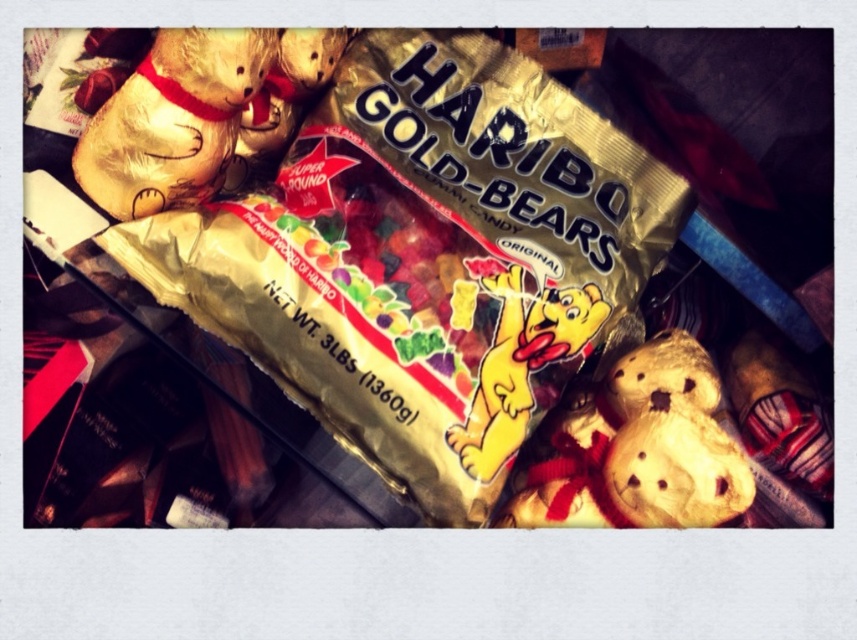
You are looking at the Haribo Gold Bears candy package. There is a matte gold plush bear at lower right and a gold foil bear at upper left. Which bear appears closer to you?

The matte gold plush bear at lower right appears closer to you because it is further to the viewer than the gold foil bear at upper left.

You are organizing a party and need to arrange decorations. You have a matte gold plush bear at lower right and a yellow paper bear at center. Which bear should you place in a more prominent position to draw attention, and why?

The matte gold plush bear at lower right is larger in size than the yellow paper bear at center, so placing the matte gold plush bear at lower right in a more prominent position will draw more attention due to its larger size.